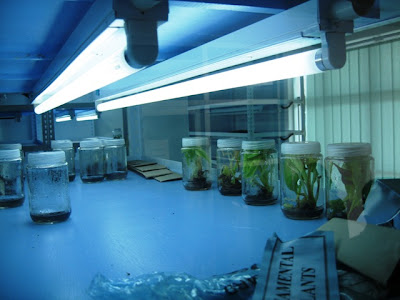
The width and height of the screenshot is (400, 300). I want to click on counter, so click(x=175, y=243).